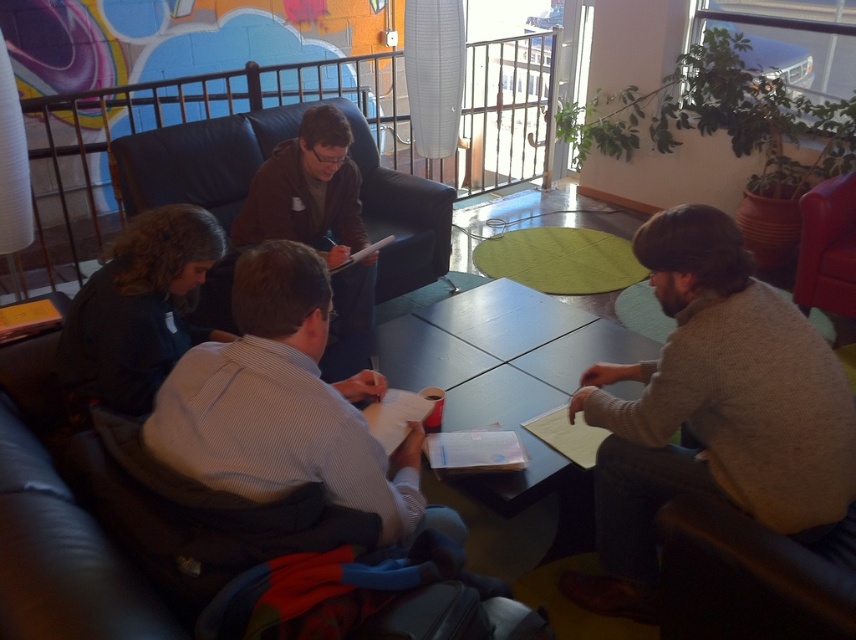
Question: Which point is farther from the camera taking this photo?

Choices:
 (A) (485, 502)
 (B) (625, 378)

Answer: (B)

Question: Which of the following is the closest to the observer?

Choices:
 (A) black leather armchair at lower right
 (B) knit sweater at right

Answer: (A)

Question: Estimate the real-world distances between objects in this image. Which object is closer to the matte black armchair at center?

Choices:
 (A) dark brown leather jacket at center
 (B) smooth dark wood table at center
 (C) knit sweater at right

Answer: (A)

Question: Can you confirm if knit sweater at right is wider than smooth dark wood table at center?

Choices:
 (A) yes
 (B) no

Answer: (B)

Question: Does matte black armchair at center appear over black leather armchair at lower right?

Choices:
 (A) no
 (B) yes

Answer: (B)

Question: Where is knit sweater at right located in relation to smooth dark wood table at center in the image?

Choices:
 (A) above
 (B) below

Answer: (B)